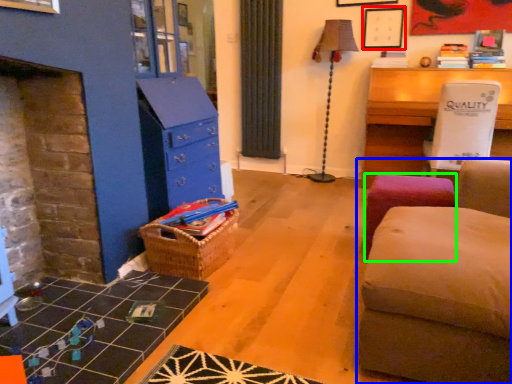
Question: Which object is positioned farthest from picture frame (highlighted by a red box)? Select from studio couch (highlighted by a blue box) and stool (highlighted by a green box).

Choices:
 (A) studio couch
 (B) stool

Answer: (A)